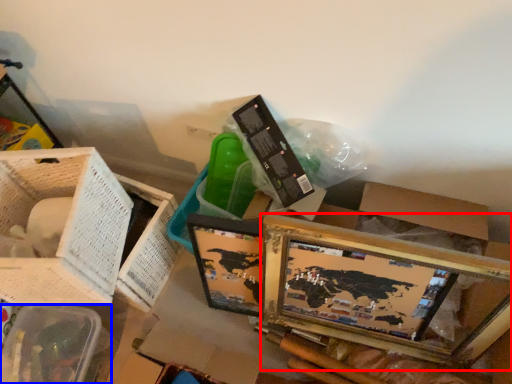
Question: Which object appears farthest to the camera in this image, picture frame (highlighted by a red box) or basket (highlighted by a blue box)?

Choices:
 (A) picture frame
 (B) basket

Answer: (B)